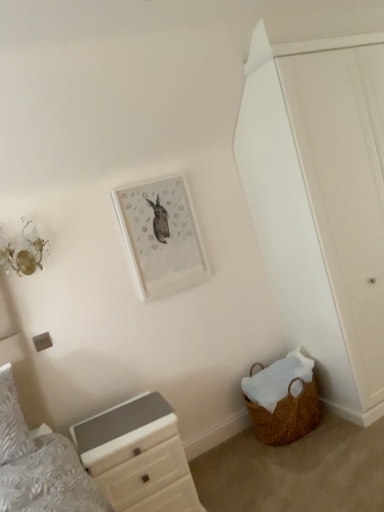
Question: From the image's perspective, is white matte door at right located above or below white glossy chest of drawers at lower left?

Choices:
 (A) below
 (B) above

Answer: (B)

Question: Visually, is white matte door at right positioned to the left or to the right of white glossy chest of drawers at lower left?

Choices:
 (A) right
 (B) left

Answer: (A)

Question: Which object is the closest to the white matte door at right?

Choices:
 (A) brown woven basket at lower right
 (B) white glossy chest of drawers at lower left
 (C) white textured pillow at left
 (D) matte white picture frame at upper center

Answer: (A)

Question: Which is nearer to the white glossy chest of drawers at lower left?

Choices:
 (A) brown woven basket at lower right
 (B) white matte door at right
 (C) white textured pillow at left
 (D) matte white picture frame at upper center

Answer: (C)